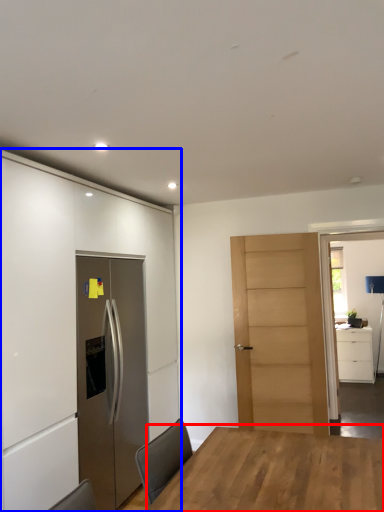
Question: Which object is closer to the camera taking this photo, table (highlighted by a red box) or cabinetry (highlighted by a blue box)?

Choices:
 (A) table
 (B) cabinetry

Answer: (A)